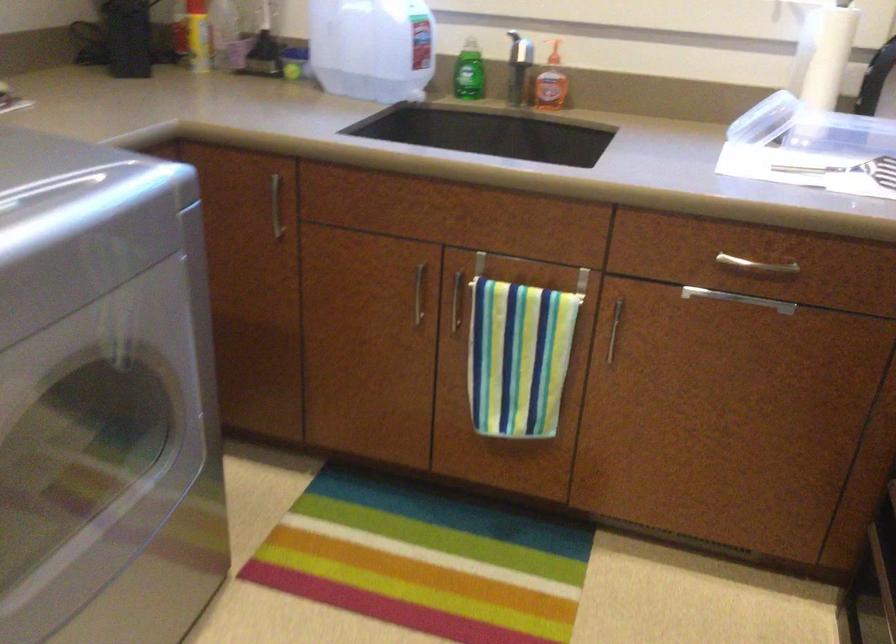
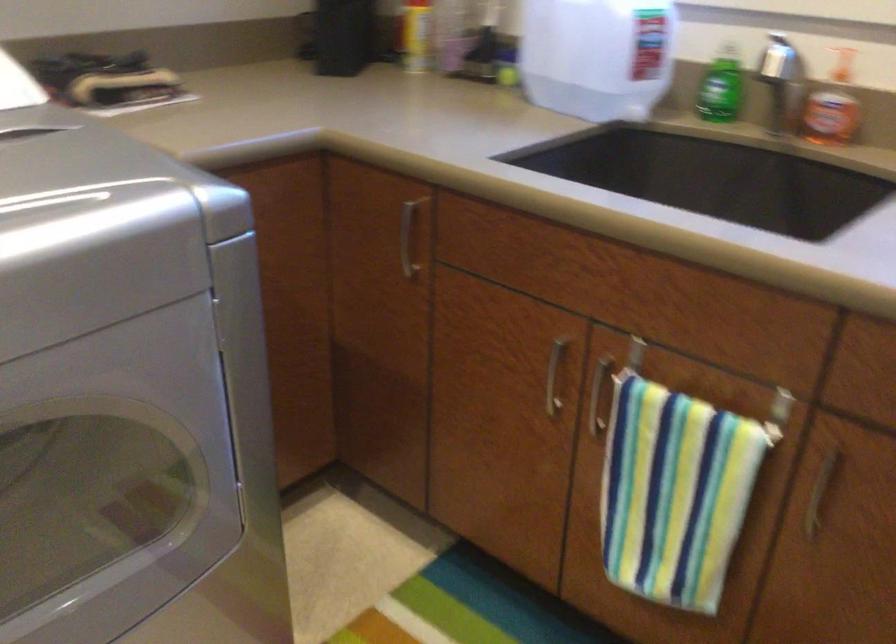
Where in the second image is the point corresponding to point (522, 75) from the first image?

(788, 96)